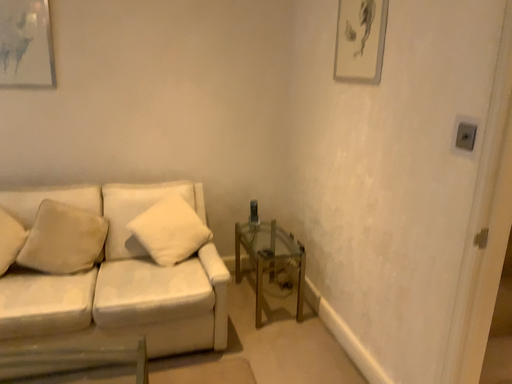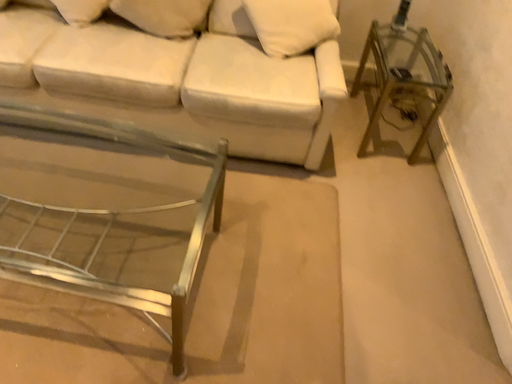
Question: Which way did the camera rotate in the video?

Choices:
 (A) rotated downward
 (B) rotated upward

Answer: (A)